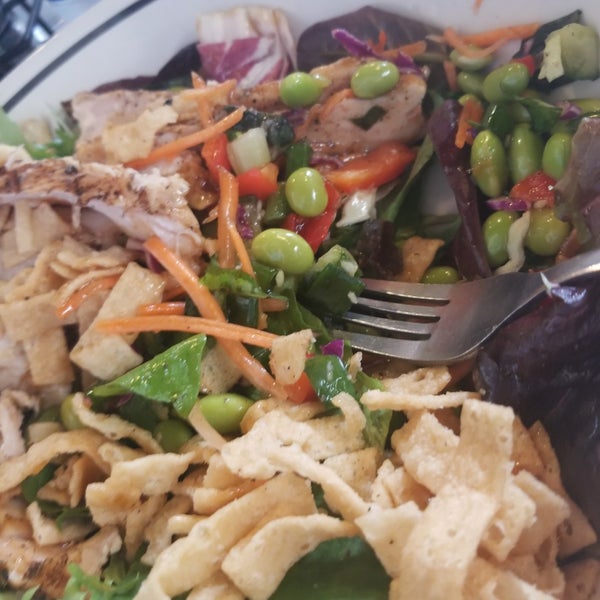
The image size is (600, 600). I want to click on fork, so click(x=493, y=309).